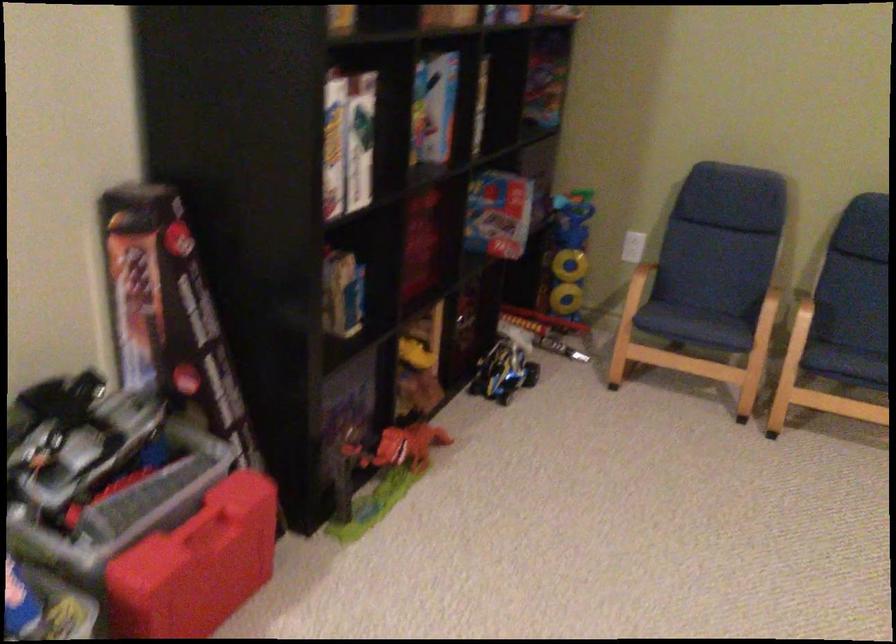
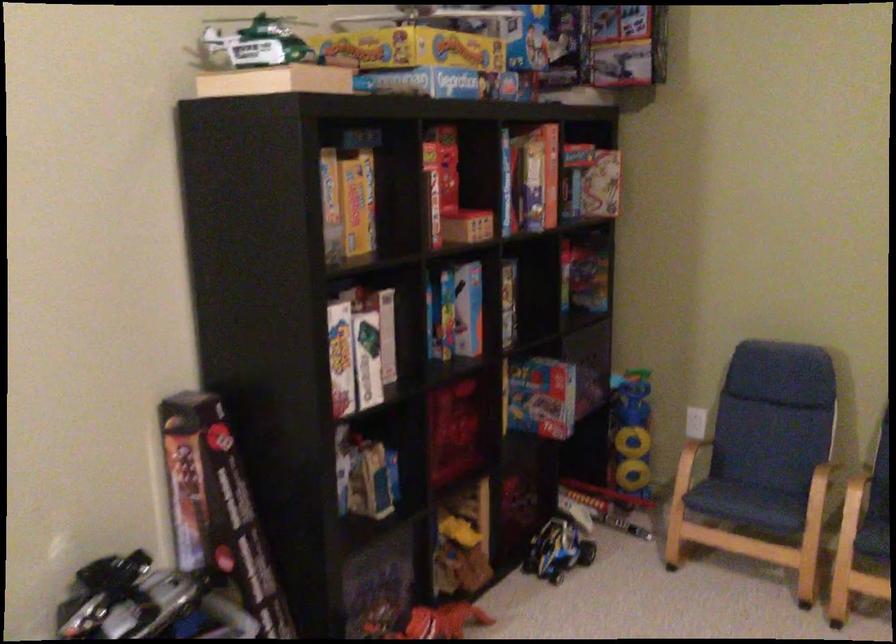
In the second image, find the point that corresponds to [696,319] in the first image.

(747, 500)